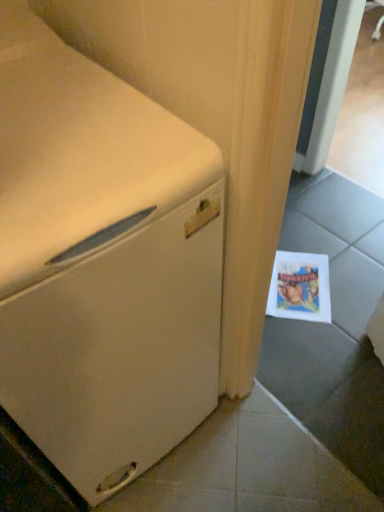
Identify the location of free space above matte paper postcard at lower right (from a real-world perspective). (299, 283).